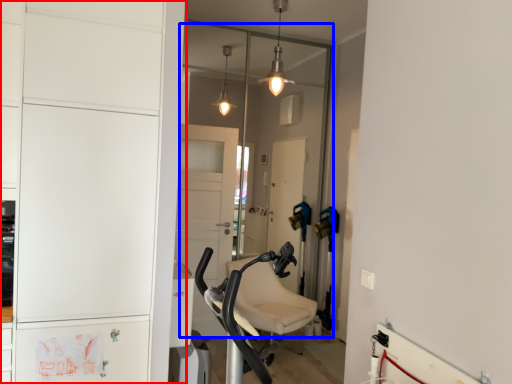
Question: Which object is closer to the camera taking this photo, cabinetry (highlighted by a red box) or glass door (highlighted by a blue box)?

Choices:
 (A) cabinetry
 (B) glass door

Answer: (A)